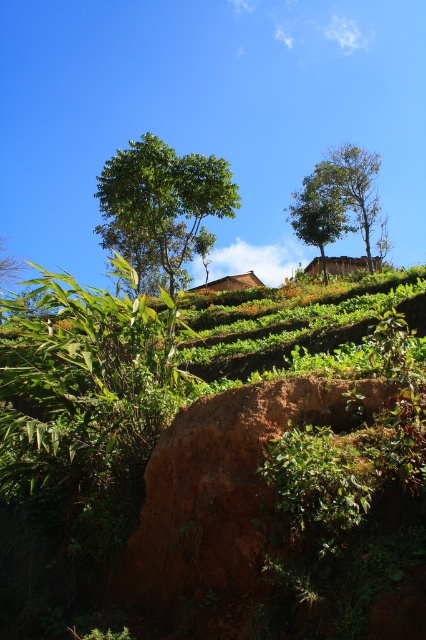
Which is behind, point (155, 182) or point (316, 182)?

Point (316, 182)

Does green leafy tree at upper left appear under green leafy tree at upper center?

Yes.

Where is `green leafy tree at upper left`? The image size is (426, 640). green leafy tree at upper left is located at coordinates (161, 204).

In order to click on green leafy tree at upper left in this screenshot , I will do `click(161, 204)`.